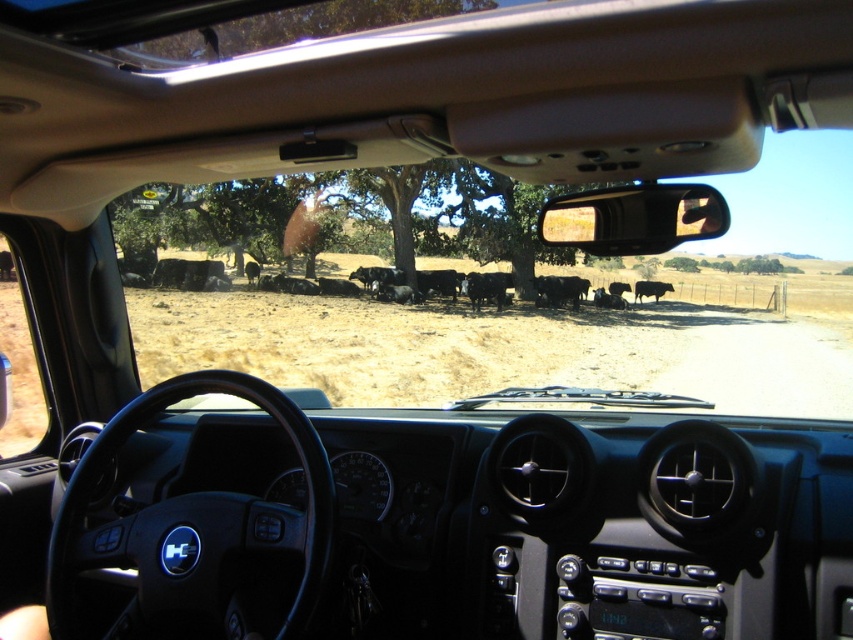
You are driving a car and want to check if the distance between the black matte cows at center and the transparent glass window at lower left is sufficient to safely pass through. Given that your car is 5 meters long, can you safely navigate between them?

The distance between the black matte cows at center and the transparent glass window at lower left is 20.49 meters, which is more than enough for a car that is 5 meters long to safely navigate between them.

In the scene shown: You are driving a car and notice a green leafy tree at upper center and a black glossy cow at center through the windshield. Which object appears thinner when viewed from your current position inside the car?

The green leafy tree at upper center appears thinner than the black glossy cow at center.

You are a driver who needs to check the distance between the black matte cows at center and the green leafy tree at upper center while driving. Which object would appear closer to you through the windshield?

The black matte cows at center appears closer to you than the green leafy tree at upper center because it is larger in size.